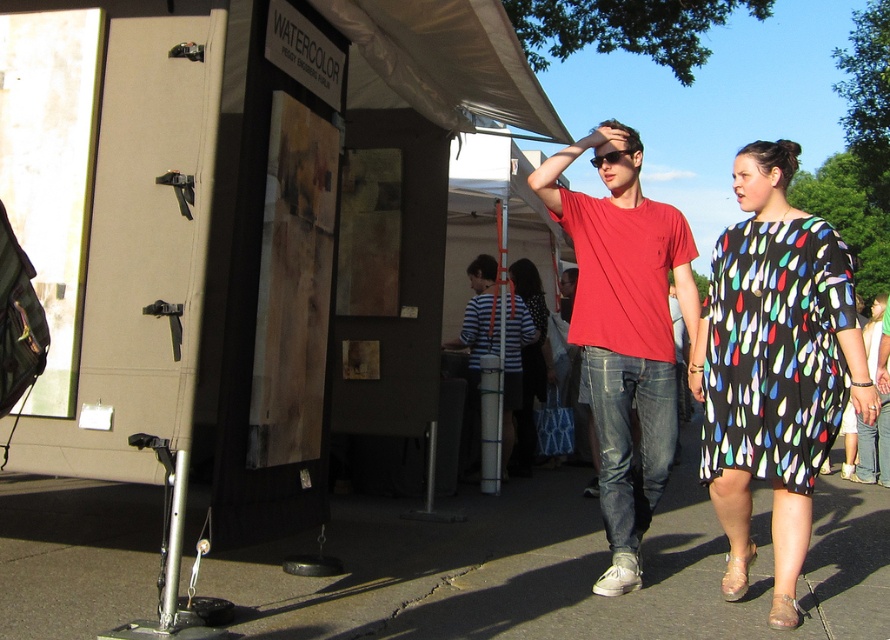
Question: Estimate the real-world distances between objects in this image. Which object is closer to the gray asphalt pavement at center?

Choices:
 (A) black printed dress at center
 (B) striped fabric dress at center
 (C) striped fabric shirt at center

Answer: (A)

Question: Can you confirm if matte red t-shirt at center is positioned to the left of striped fabric shirt at center?

Choices:
 (A) no
 (B) yes

Answer: (A)

Question: Is black printed dress at right smaller than striped fabric shirt at center?

Choices:
 (A) no
 (B) yes

Answer: (B)

Question: Which point is closer to the camera?

Choices:
 (A) (641, 364)
 (B) (530, 291)

Answer: (A)

Question: Which of these objects is positioned farthest from the gray asphalt pavement at center?

Choices:
 (A) striped fabric dress at center
 (B) matte red t-shirt at center
 (C) striped fabric shirt at center
 (D) black printed dress at right

Answer: (A)

Question: Can you confirm if gray asphalt pavement at center is thinner than matte red t-shirt at center?

Choices:
 (A) no
 (B) yes

Answer: (A)